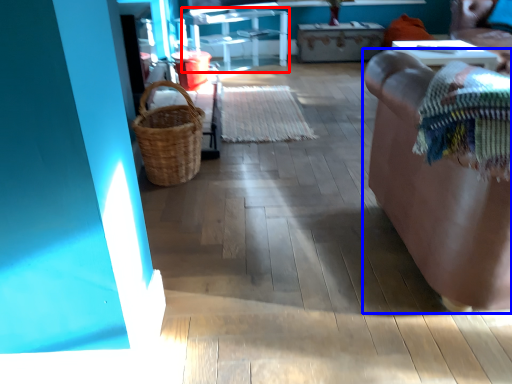
Question: Which object is further to the camera taking this photo, furniture (highlighted by a red box) or furniture (highlighted by a blue box)?

Choices:
 (A) furniture
 (B) furniture

Answer: (A)